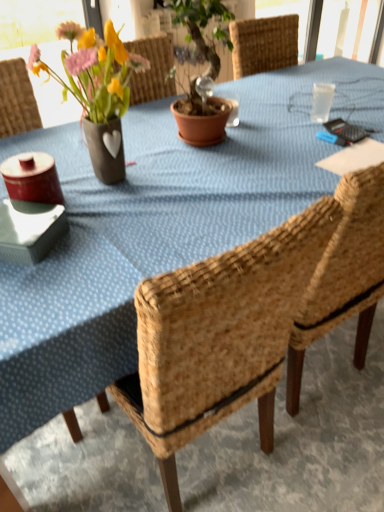
Question: From a real-world perspective, relative to matte ceramic vase at upper left, is woven wood chair at center vertically above or below?

Choices:
 (A) below
 (B) above

Answer: (A)

Question: In the image, is woven wood chair at center on the left side or the right side of matte ceramic vase at upper left?

Choices:
 (A) right
 (B) left

Answer: (A)

Question: Looking at their shapes, would you say woven wood chair at center is wider or thinner than matte ceramic vase at upper left?

Choices:
 (A) thin
 (B) wide

Answer: (B)

Question: Looking at their shapes, would you say matte ceramic vase at upper left is wider or thinner than woven wood chair at center?

Choices:
 (A) thin
 (B) wide

Answer: (A)

Question: From a real-world perspective, relative to woven wood chair at center, is matte ceramic vase at upper left vertically above or below?

Choices:
 (A) below
 (B) above

Answer: (B)

Question: Considering the positions of point (87, 119) and point (158, 352), is point (87, 119) closer or farther from the camera than point (158, 352)?

Choices:
 (A) farther
 (B) closer

Answer: (A)

Question: Is matte ceramic vase at upper left inside or outside of woven wood chair at center?

Choices:
 (A) outside
 (B) inside

Answer: (A)